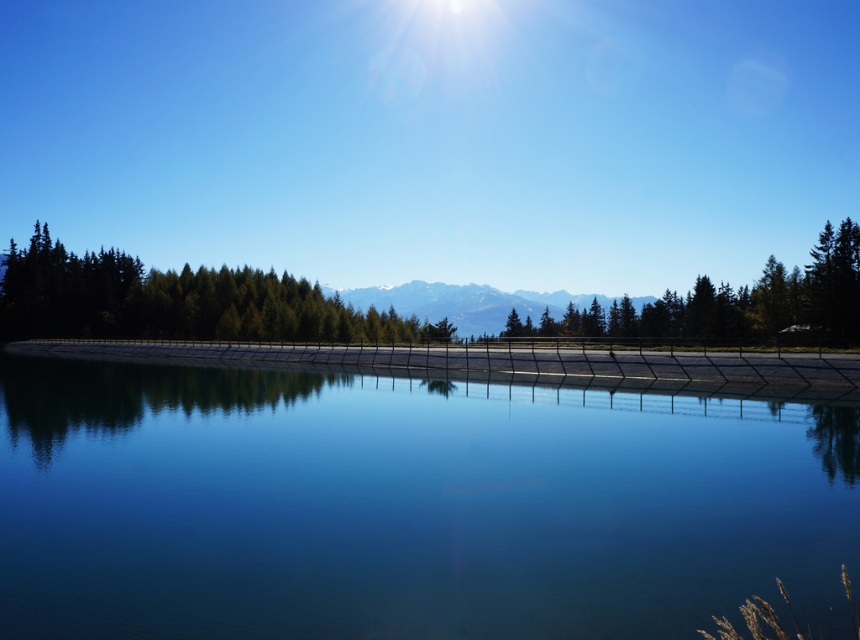
Which of these two, green matte trees at center or snowy white mountain at center, stands taller?

snowy white mountain at center is taller.

Is point (372, 332) positioned in front of point (553, 296)?

That is True.

Find the location of `green matte trees at center`. green matte trees at center is located at coordinates (174, 300).

Which is more to the left, green matte tree at center or snowy white mountain at center?

Positioned to the left is snowy white mountain at center.

Consider the image. Can you confirm if green matte tree at center is bigger than snowy white mountain at center?

No.

Is point (693, 296) positioned in front of point (480, 291)?

Yes, it is.

Identify the location of green matte tree at center. (736, 301).

Is point (510, 467) less distant than point (262, 273)?

Yes, it is.

Who is more forward, (152, 564) or (206, 332)?

Point (152, 564) is in front.

Where is `transparent glass water at center`? Image resolution: width=860 pixels, height=640 pixels. transparent glass water at center is located at coordinates (407, 506).